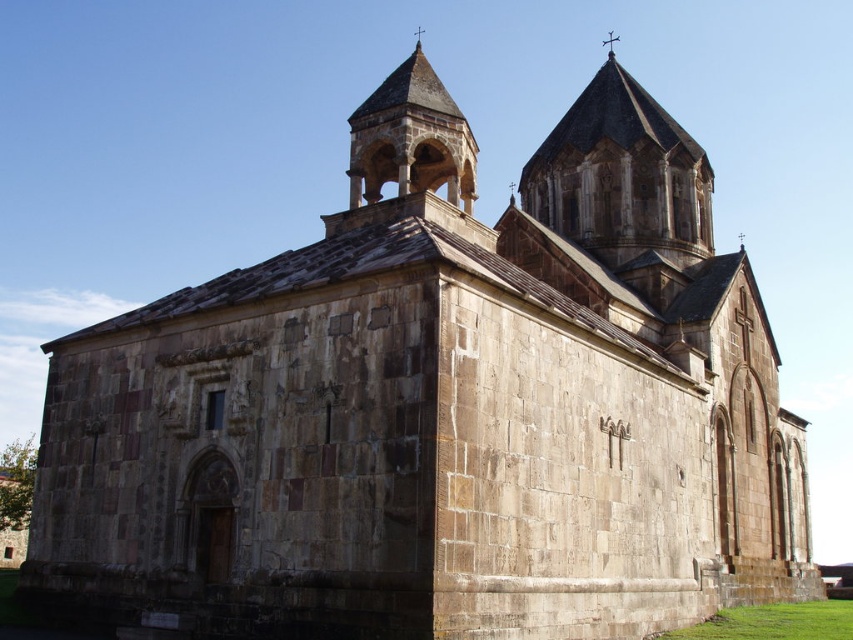
Who is lower down, stone arched tower at center or polished metal cross at upper center?

stone arched tower at center is below.

Is stone arched tower at center positioned in front of polished metal cross at upper center?

That is True.

This screenshot has height=640, width=853. In order to click on stone arched tower at center in this screenshot , I will do 410,138.

At what (x,y) coordinates should I click in order to perform the action: click on stone arched tower at center. Please return your answer as a coordinate pair (x, y). The image size is (853, 640). Looking at the image, I should click on (410, 138).

Who is positioned more to the left, stone tower at upper center or stone arched tower at center?

Positioned to the left is stone arched tower at center.

Is stone tower at upper center thinner than stone arched tower at center?

No, stone tower at upper center is not thinner than stone arched tower at center.

Where is `stone tower at upper center`? stone tower at upper center is located at coordinates (621, 177).

Is stone tower at upper center closer to camera compared to polished metal cross at upper center?

That is True.

Is point (614, 113) more distant than point (611, 36)?

No, it is not.

Find the location of a particular element. The image size is (853, 640). stone tower at upper center is located at coordinates (621, 177).